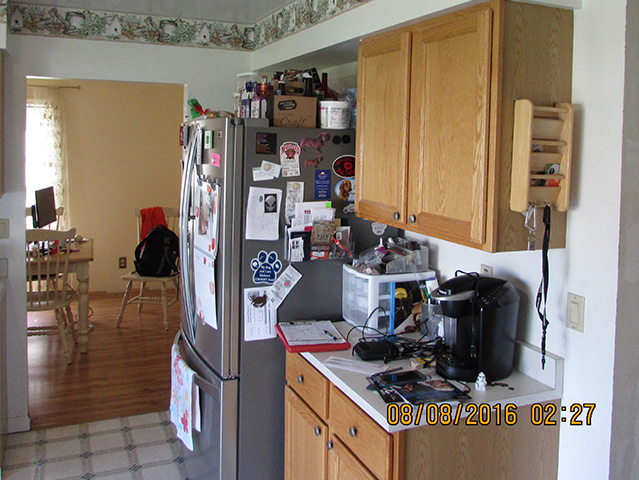
The height and width of the screenshot is (480, 639). In order to click on window in this screenshot , I will do coord(36,152).